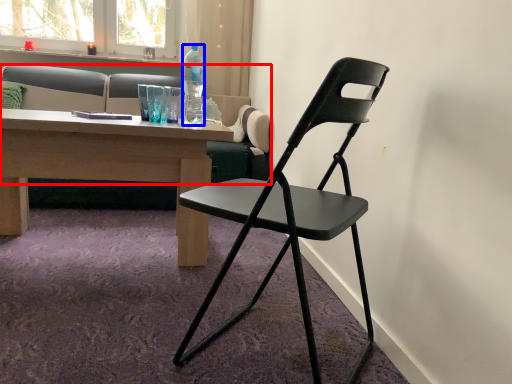
Question: Among these objects, which one is nearest to the camera, studio couch (highlighted by a red box) or bottle (highlighted by a blue box)?

Choices:
 (A) studio couch
 (B) bottle

Answer: (B)